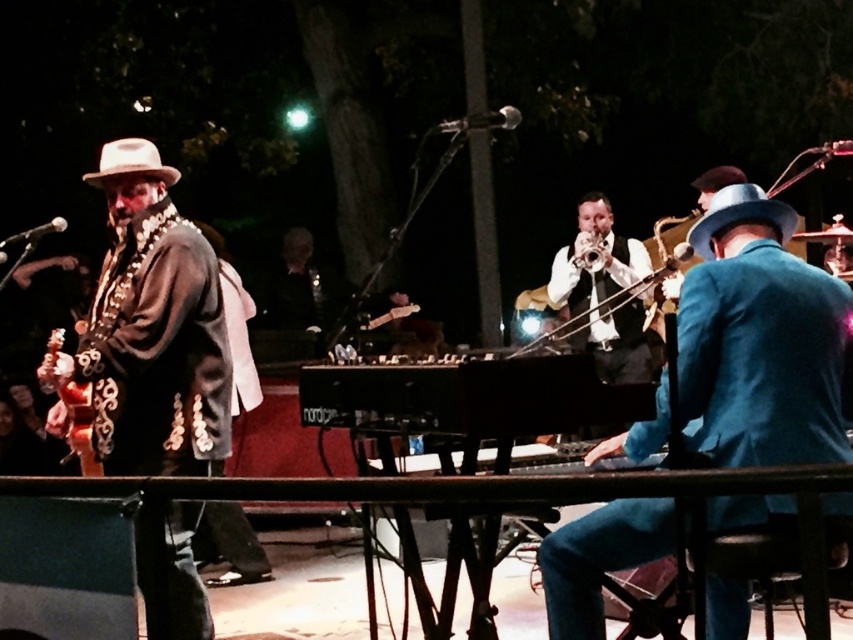
You are a fashion designer attending the concert and want to create a new outfit using the blue velvet suit at center and the light beige felt fedora at left. Which item would you need to adjust in size to ensure they are proportionally balanced?

The blue velvet suit at center has a larger size compared to light beige felt fedora at left. To balance their proportions, you would need to increase the size of the light beige felt fedora at left to match the scale of the blue velvet suit at center.

You are a photographer at the event and want to capture a clear shot of the black polished piano at center and the blue felt hat at right. Since you can only focus on one object, which one should you choose to ensure it appears sharp in the photo?

The black polished piano at center is closer to the viewer than the blue felt hat at right, so focusing on the black polished piano at center will ensure it appears sharp. If the photographer focuses on the blue felt hat at right, the piano may appear blurry due to the depth of field limitations.

You are a photographer positioned at the center of the stage. You want to capture a closeup shot of the blue felt hat at right. Based on its coordinates, is the hat positioned to your left or right side?

The blue felt hat at right is located at point 0.338 on the x axis and 0.868 on the y axis. Since the x coordinate is less than 0.5, the hat is positioned to your left side.